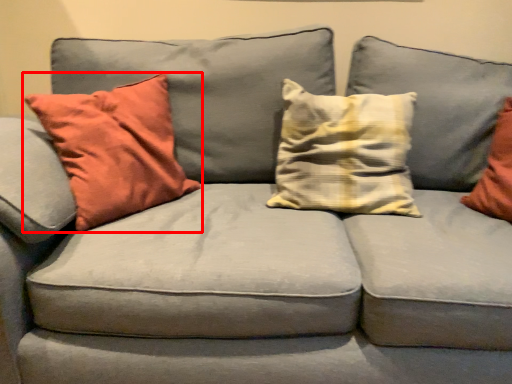
Question: Observing the image, what is the correct spatial positioning of pillow (annotated by the red box) in reference to pillow?

Choices:
 (A) left
 (B) right

Answer: (A)